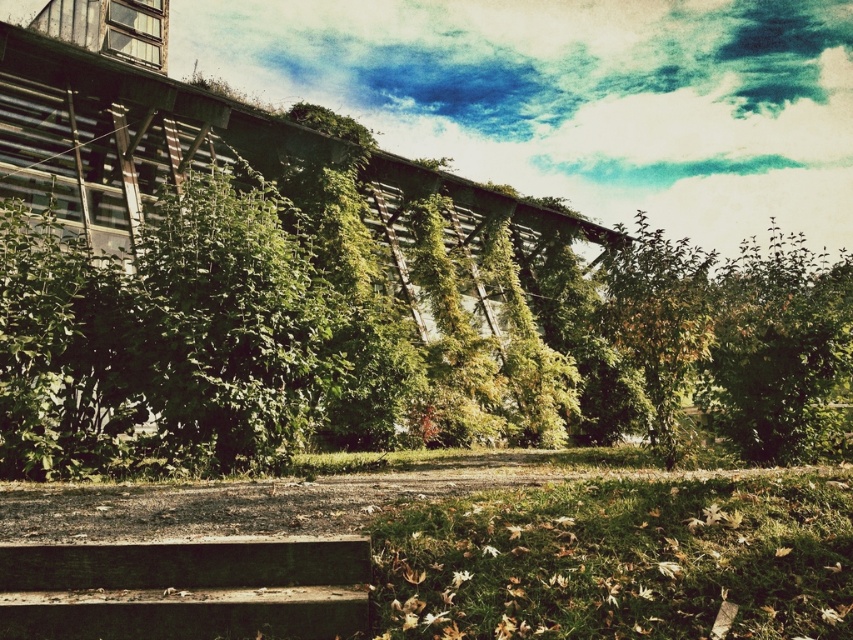
Question: Does dark brown wooden stairs at lower center appear over green leafy tree at right?

Choices:
 (A) yes
 (B) no

Answer: (B)

Question: Is dark brown wooden stairs at lower center bigger than green leafy tree at right?

Choices:
 (A) no
 (B) yes

Answer: (A)

Question: Is dark brown wooden stairs at lower center to the left of green leafy tree at right from the viewer's perspective?

Choices:
 (A) no
 (B) yes

Answer: (B)

Question: Which of the following is the farthest from the observer?

Choices:
 (A) (755, 369)
 (B) (206, 604)

Answer: (A)